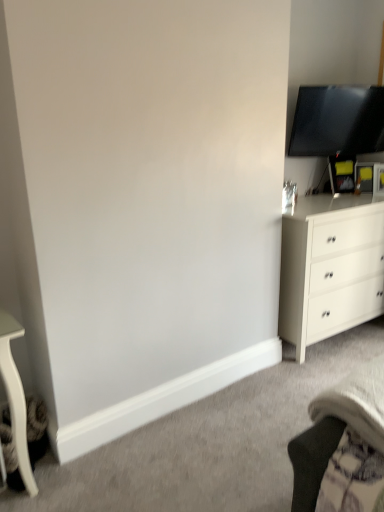
Question: Can matte black tv at upper right be found inside white matte chest of drawers at right?

Choices:
 (A) yes
 (B) no

Answer: (B)

Question: Considering the relative sizes of white matte chest of drawers at right and matte black tv at upper right in the image provided, is white matte chest of drawers at right shorter than matte black tv at upper right?

Choices:
 (A) yes
 (B) no

Answer: (B)

Question: Considering the relative positions of white matte chest of drawers at right and matte black tv at upper right in the image provided, is white matte chest of drawers at right to the left of matte black tv at upper right from the viewer's perspective?

Choices:
 (A) no
 (B) yes

Answer: (B)

Question: Is white matte chest of drawers at right to the right of matte black tv at upper right from the viewer's perspective?

Choices:
 (A) no
 (B) yes

Answer: (A)

Question: Is matte black tv at upper right at the back of white matte chest of drawers at right?

Choices:
 (A) yes
 (B) no

Answer: (B)

Question: Is white matte chest of drawers at right behind matte black tv at upper right?

Choices:
 (A) no
 (B) yes

Answer: (A)

Question: From the image's perspective, would you say matte black tv at upper right is shown under white matte chest of drawers at right?

Choices:
 (A) yes
 (B) no

Answer: (B)

Question: Is the position of matte black tv at upper right less distant than that of white matte chest of drawers at right?

Choices:
 (A) yes
 (B) no

Answer: (B)

Question: Is matte black tv at upper right next to white matte chest of drawers at right?

Choices:
 (A) no
 (B) yes

Answer: (A)

Question: Is the depth of matte black tv at upper right greater than that of white matte chest of drawers at right?

Choices:
 (A) no
 (B) yes

Answer: (B)

Question: Does matte black tv at upper right appear on the left side of white matte chest of drawers at right?

Choices:
 (A) yes
 (B) no

Answer: (B)

Question: From the image's perspective, would you say matte black tv at upper right is positioned over white matte chest of drawers at right?

Choices:
 (A) yes
 (B) no

Answer: (A)

Question: Considering the relative positions of white matte chest of drawers at right and matte black tv at upper right in the image provided, is white matte chest of drawers at right to the left or to the right of matte black tv at upper right?

Choices:
 (A) right
 (B) left

Answer: (B)